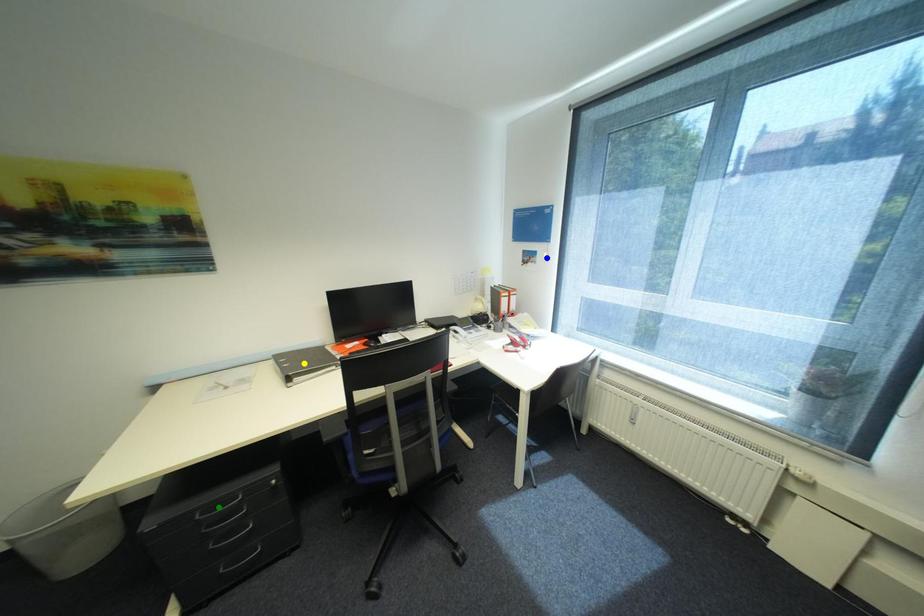
Order these from nearest to farthest:
A) blue point
B) green point
C) yellow point

green point
yellow point
blue point